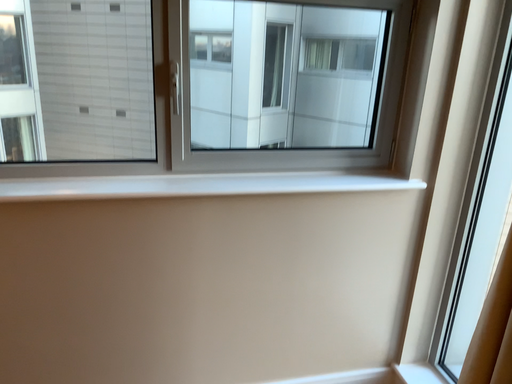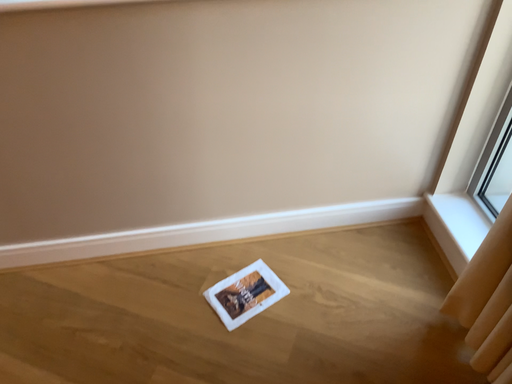
Question: Which way did the camera rotate in the video?

Choices:
 (A) rotated upward
 (B) rotated downward

Answer: (B)